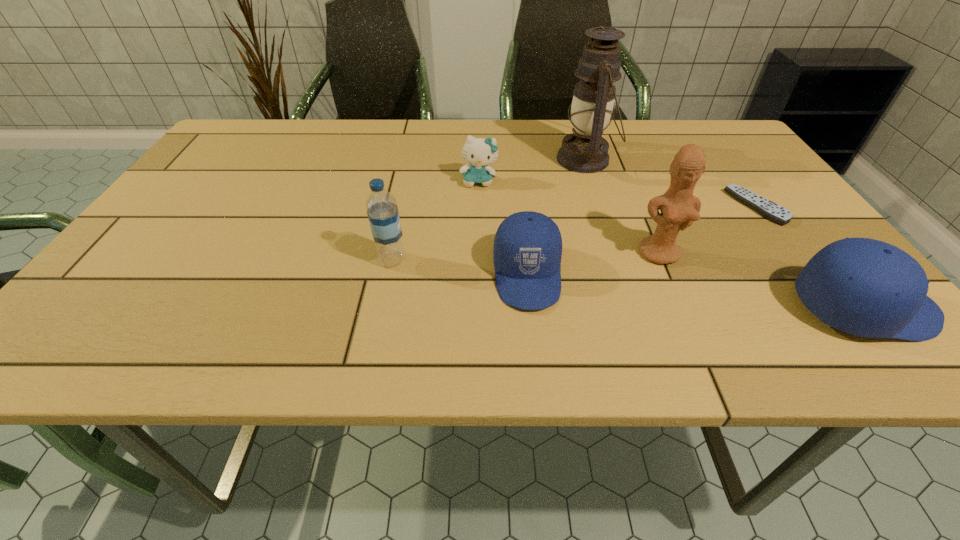
Find the location of `vacant space located on the label of the third tallest object`. vacant space located on the label of the third tallest object is located at coordinates (450, 260).

Locate an element on the screen. free space located on the front-facing side of the figurine is located at coordinates (673, 285).

Where is `object positioned at the far edge`? The width and height of the screenshot is (960, 540). object positioned at the far edge is located at coordinates (585, 151).

This screenshot has height=540, width=960. I want to click on object situated at the near edge, so click(527, 251).

Where is `object present at the right edge`? This screenshot has width=960, height=540. object present at the right edge is located at coordinates (768, 209).

This screenshot has height=540, width=960. In the image, there is a desktop. Find the location of `free space at the far edge`. free space at the far edge is located at coordinates (560, 134).

At what (x,y) coordinates should I click in order to perform the action: click on free location at the near edge of the desktop. Please return your answer as a coordinate pair (x, y). This screenshot has height=540, width=960. Looking at the image, I should click on (408, 306).

In the image, there is a desktop. Identify the location of vacant space at the left edge. The width and height of the screenshot is (960, 540). coord(247,185).

Find the location of a particular element. Image resolution: width=960 pixels, height=540 pixels. free region at the right edge is located at coordinates (814, 243).

Locate an element on the screen. The width and height of the screenshot is (960, 540). empty space that is in between the shorter cap and the figurine is located at coordinates (593, 264).